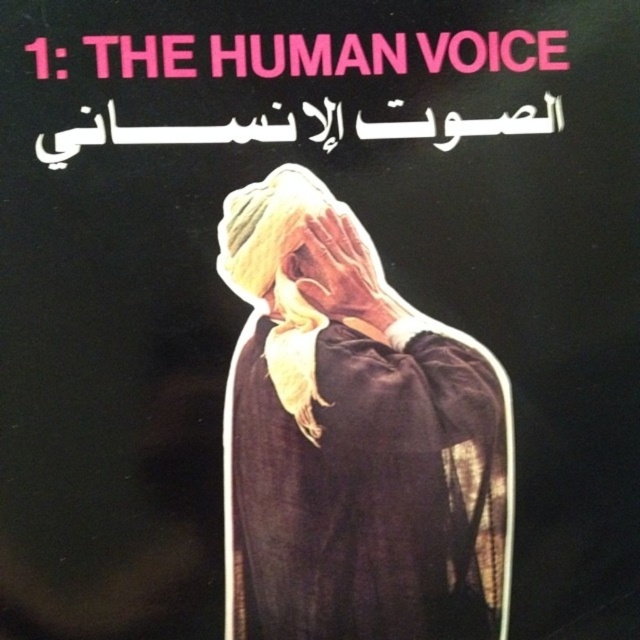
Question: Does dark brown fabric at center have a lesser width compared to smooth skin hand at center?

Choices:
 (A) no
 (B) yes

Answer: (A)

Question: Among these objects, which one is farthest from the camera?

Choices:
 (A) smooth skin hand at center
 (B) dark brown fabric at center

Answer: (A)

Question: Does dark brown fabric at center appear on the left side of smooth skin hand at center?

Choices:
 (A) yes
 (B) no

Answer: (A)

Question: Which of the following is the farthest from the observer?

Choices:
 (A) (392, 392)
 (B) (314, 260)

Answer: (A)

Question: Can you confirm if dark brown fabric at center is bigger than smooth skin hand at center?

Choices:
 (A) yes
 (B) no

Answer: (A)